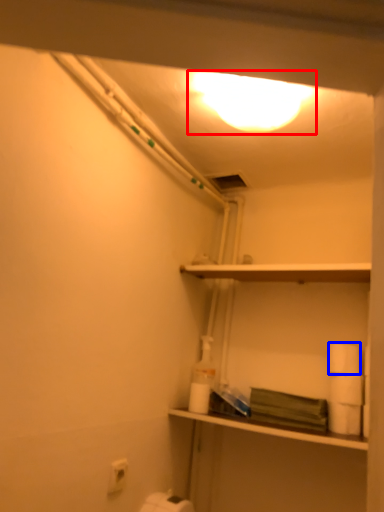
Question: Which point is closer to the camera, lighting (highlighted by a red box) or toilet paper (highlighted by a blue box)?

Choices:
 (A) lighting
 (B) toilet paper

Answer: (A)